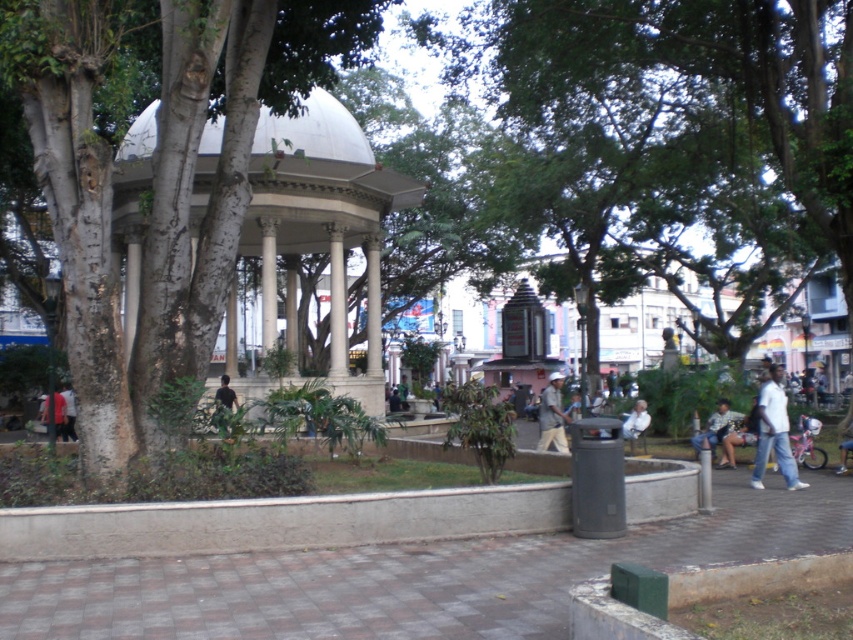
You are a photographer standing at the edge of the paved area in the park. You want to take a photo that includes both the light brown fabric shirt at center and the black matte shirt at center. Given that your camera has a maximum focus range of 20 feet, will you be able to capture both subjects clearly in the same frame?

The distance between the light brown fabric shirt at center and the black matte shirt at center is 24.47 feet. Since the camera can only focus up to 20 feet, it won not be able to capture both subjects clearly in the same frame.

You are a photographer setting up a tripod in the park. You need to position it between the white matte shirt at right and the light brown leather jacket at lower right. The tripod requires at least 1.5 meters of space between the two objects to fit. Is there enough space?

The white matte shirt at right is 1.65 meters from the light brown leather jacket at lower right, so yes, there is enough space for the tripod since the distance is greater than the required 1.5 meters.

You are standing in the park and want to take a photo of the white marble column at center and the white fabric shirt at center. Which object should you focus on first if you want to capture both in the same frame without moving the camera?

You should focus on the white marble column at center first because it is closer to you than the white fabric shirt at center. By focusing on the closer object, both will be in focus if they are within the camera lens depth of field.